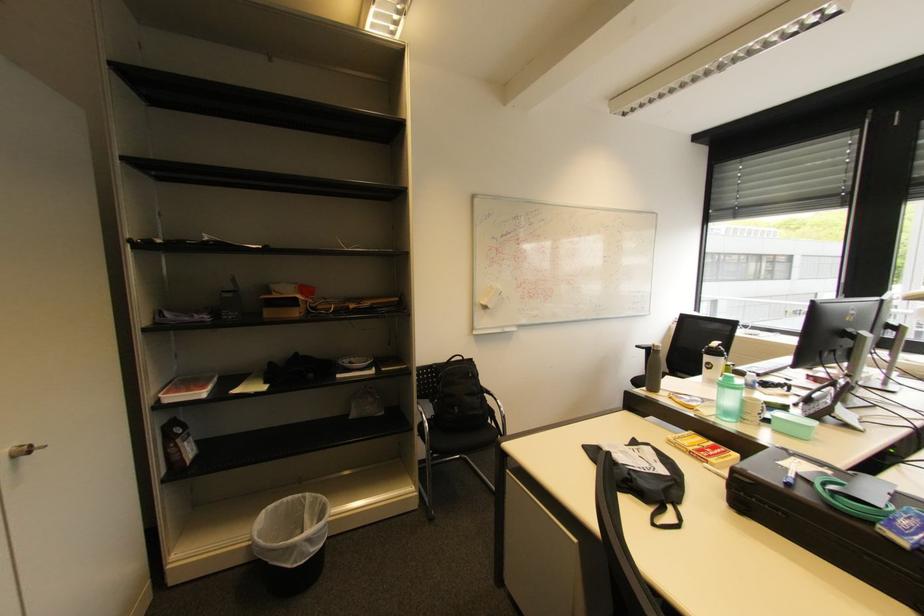
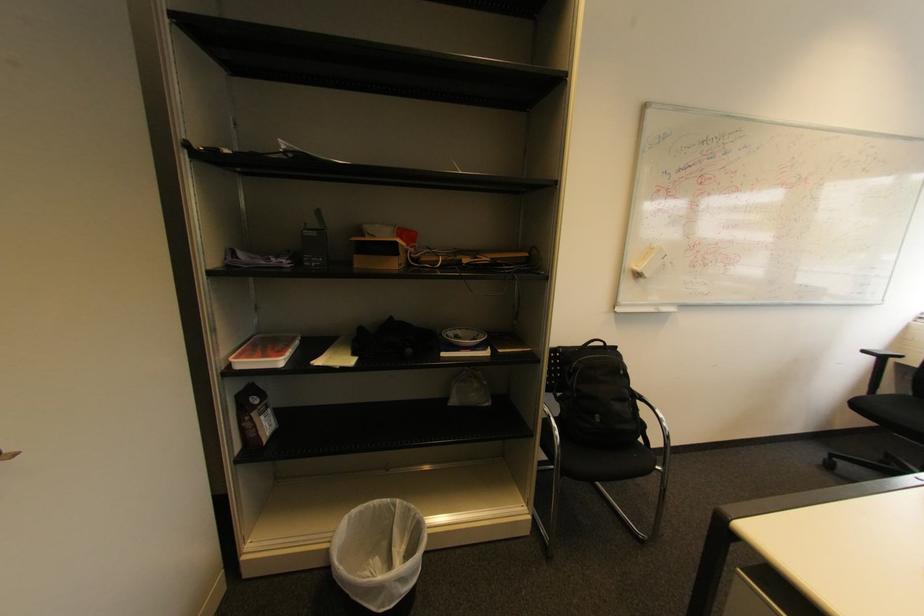
In the second image, find the point that corresponds to point (641, 347) in the first image.

(869, 352)